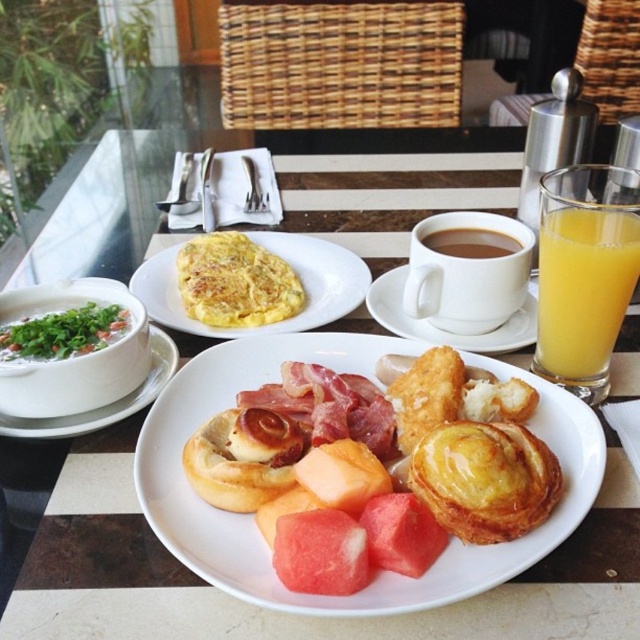
Can you confirm if yellow fried egg at center is positioned below brown matte cup at center?

Yes.

Does yellow fried egg at center have a lesser height compared to brown matte cup at center?

No.

Is point (216, 300) farther from camera compared to point (480, 241)?

No.

Where is `yellow fried egg at center`? The image size is (640, 640). yellow fried egg at center is located at coordinates pos(236,282).

Can you confirm if green leafy soup at left is wider than white ceramic bowl at left?

Incorrect, green leafy soup at left's width does not surpass white ceramic bowl at left's.

Who is higher up, green leafy soup at left or white ceramic bowl at left?

green leafy soup at left is higher up.

The width and height of the screenshot is (640, 640). In order to click on green leafy soup at left in this screenshot , I will do `click(64, 332)`.

Is point (28, 358) farther from camera compared to point (470, 250)?

No, it is in front of (470, 250).

Between green leafy soup at left and brown matte cup at center, which one appears on the right side from the viewer's perspective?

From the viewer's perspective, brown matte cup at center appears more on the right side.

Between point (48, 346) and point (458, 232), which one is positioned behind?

Point (458, 232)

Image resolution: width=640 pixels, height=640 pixels. In order to click on green leafy soup at left in this screenshot , I will do `click(64, 332)`.